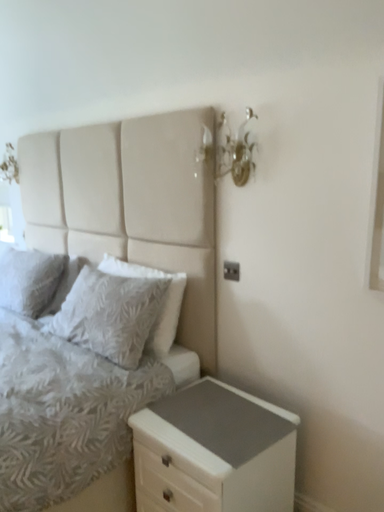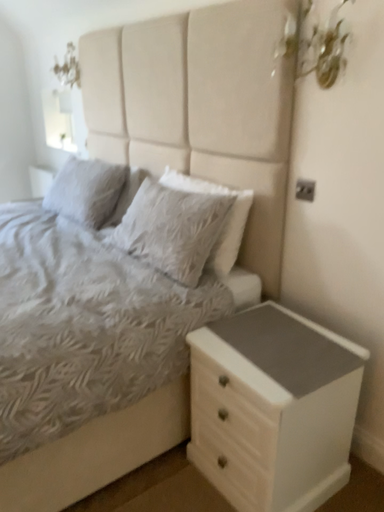
Question: How did the camera likely rotate when shooting the video?

Choices:
 (A) rotated upward
 (B) rotated downward

Answer: (B)